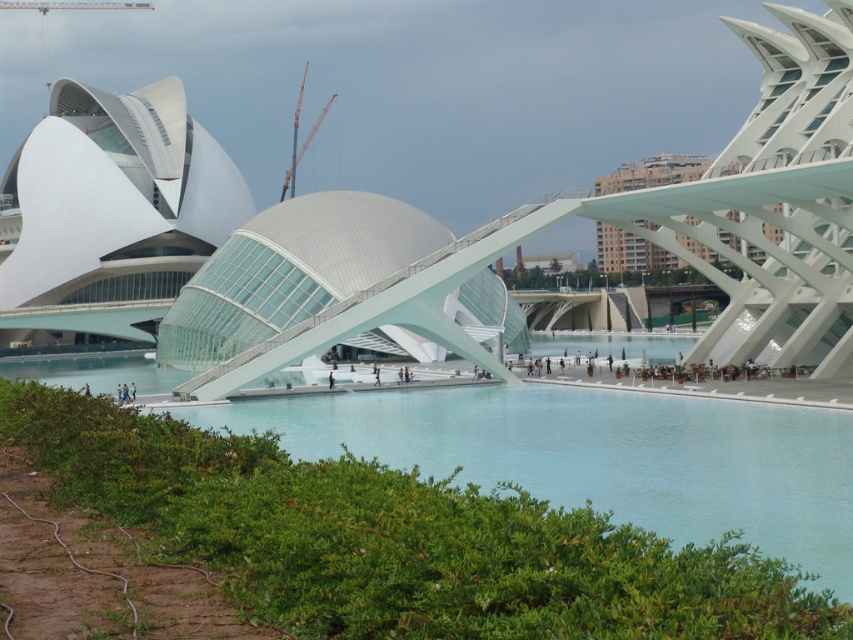
You are an architect designing a new park in this area. You need to place a statue exactly halfway between the white glass dome at center and the orange metallic crane at center. Given their widths, which object will the statue be closer to?

The statue will be closer to the orange metallic crane at center because the white glass dome at center has a larger width, making the midpoint closer to the narrower object.

You are an architect visiting this futuristic site. You see the white glass dome at center and the orange metallic crane at center. Which object would cast a larger shadow during midday when the sun is directly overhead?

The white glass dome at center is bigger than the orange metallic crane at center, so it would cast a larger shadow during midday when the sun is directly overhead.